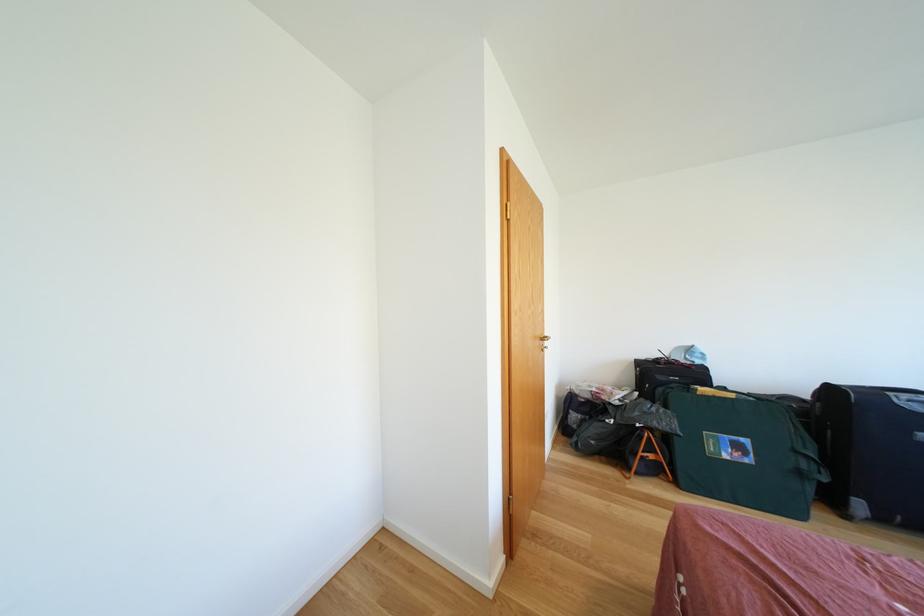
Where is `brass door handle`? brass door handle is located at coordinates (544, 341).